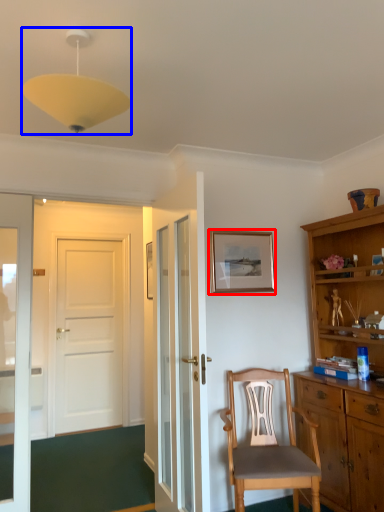
Question: Which object appears closest to the camera in this image, picture frame (highlighted by a red box) or light fixture (highlighted by a blue box)?

Choices:
 (A) picture frame
 (B) light fixture

Answer: (B)